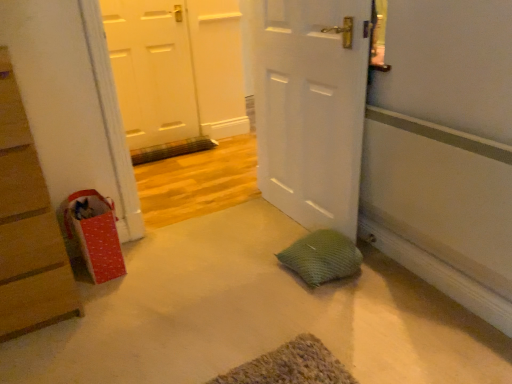
Locate an element on the screen. The image size is (512, 384). spots to the right of red dotted paper bag at left is located at coordinates (144, 264).